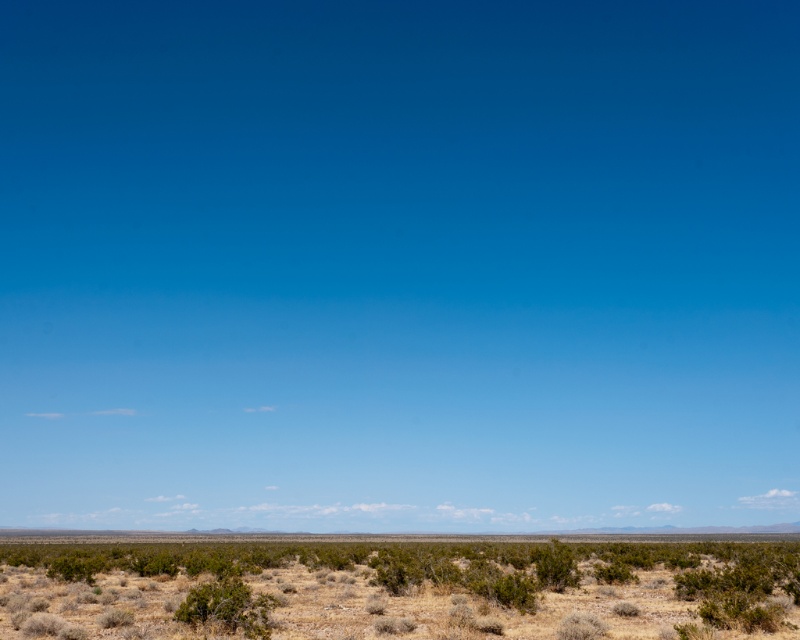
Does dry shrubbery at lower center have a smaller size compared to brown dirt at center?

Yes.

Find the location of a particular element. The width and height of the screenshot is (800, 640). dry shrubbery at lower center is located at coordinates (400, 589).